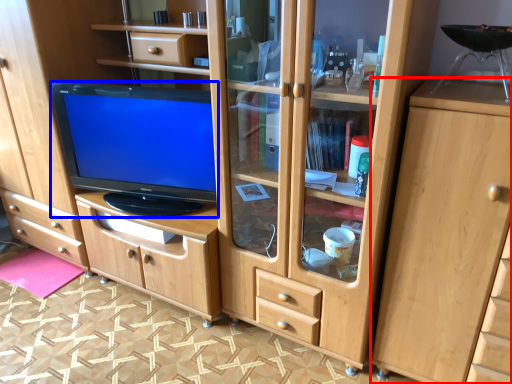
Question: Among these objects, which one is nearest to the camera, cabinetry (highlighted by a red box) or television (highlighted by a blue box)?

Choices:
 (A) cabinetry
 (B) television

Answer: (A)